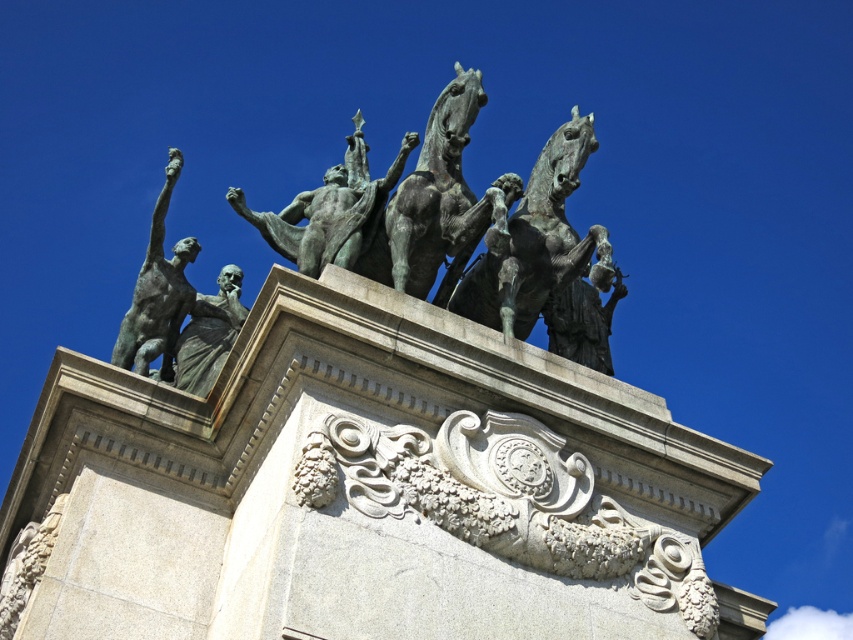
Question: Which of the following is the closest to the observer?

Choices:
 (A) bronze/greenish patina horse at center
 (B) bronze statue at center
 (C) bronze horse at upper center

Answer: (C)

Question: Among these points, which one is farthest from the camera?

Choices:
 (A) (474, 202)
 (B) (553, 259)
 (C) (297, 209)

Answer: (C)

Question: In this image, where is bronze/greenish patina horse at center located relative to bronze statue at center?

Choices:
 (A) left
 (B) right

Answer: (B)

Question: Is bronze horse at upper center thinner than bronze statue at center?

Choices:
 (A) no
 (B) yes

Answer: (B)

Question: In this image, where is bronze horse at upper center located relative to bronze/greenish patina horse at center?

Choices:
 (A) below
 (B) above

Answer: (A)

Question: Among these objects, which one is nearest to the camera?

Choices:
 (A) bronze statue at center
 (B) bronze/greenish patina horse at center
 (C) bronze horse at upper center

Answer: (C)